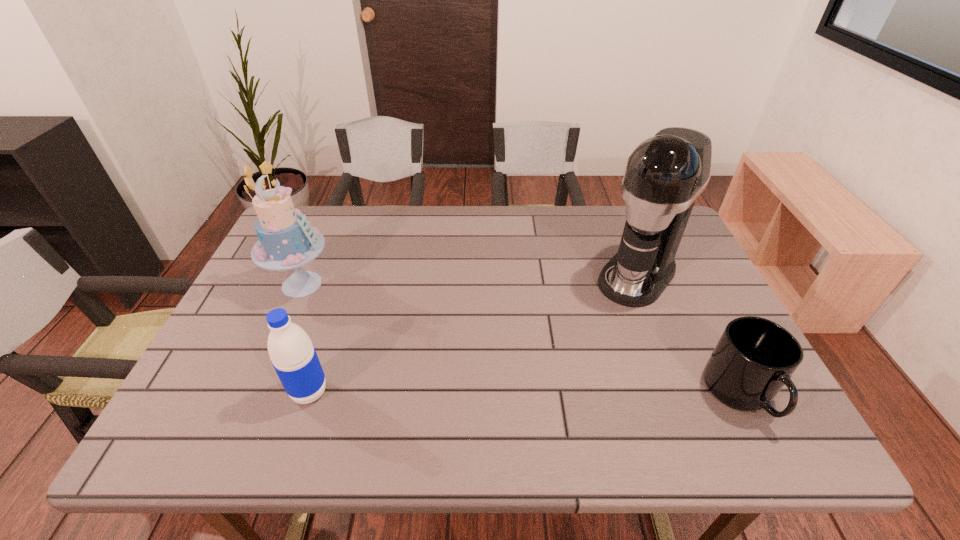
Identify the location of vacant area situated 0.050m with a ladder on the side of the third shortest object. (337, 305).

Locate an element on the screen. This screenshot has height=540, width=960. object at the far edge is located at coordinates (665, 174).

This screenshot has height=540, width=960. I want to click on water bottle at the near edge, so click(294, 358).

Locate an element on the screen. This screenshot has height=540, width=960. mug that is at the near edge is located at coordinates (754, 358).

Identify the location of object present at the left edge. This screenshot has height=540, width=960. (286, 241).

Locate an element on the screen. The height and width of the screenshot is (540, 960). mug situated at the right edge is located at coordinates (754, 358).

Find the location of a particular element. This screenshot has height=540, width=960. coffee maker situated at the right edge is located at coordinates (665, 174).

This screenshot has height=540, width=960. I want to click on object that is positioned at the far right corner, so click(x=665, y=174).

I want to click on object that is positioned at the near right corner, so click(754, 358).

Find the location of a particular element. The height and width of the screenshot is (540, 960). vacant space at the far edge of the desktop is located at coordinates (440, 248).